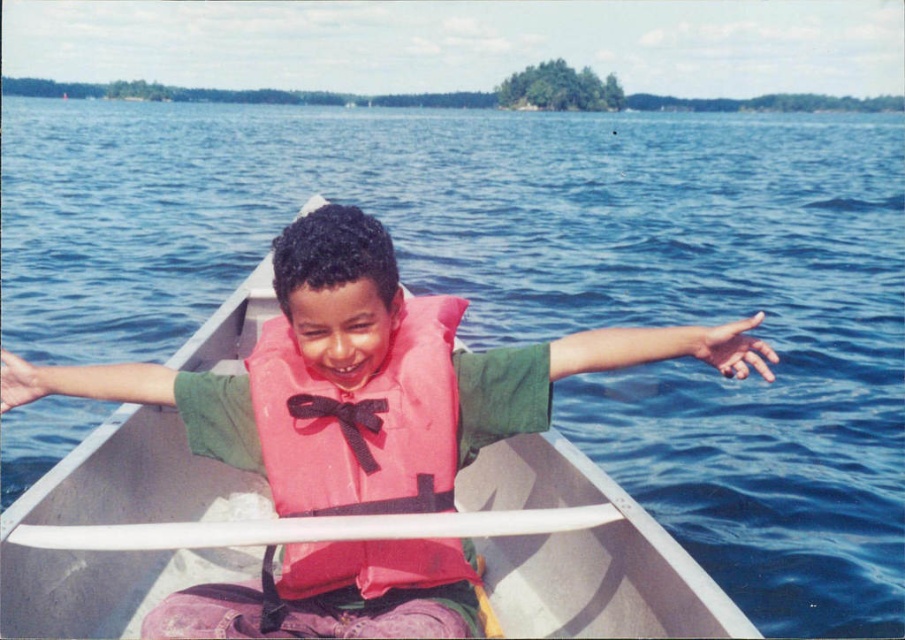
You are a photographer trying to capture the pink fabric life vest at center in a closeup shot. Given that the camera can only focus on objects within a 0.1 unit radius around the point of interest, will the point at coordinates point [329,390] be within the focus range?

The pink fabric life vest at center is represented by point [329,390], so yes, the point at coordinates point [329,390] will be within the focus range since it exactly matches the point of interest.

You are a photographer trying to capture the child in the canoe. You notice the pink fabric life jacket at center and the white plastic paddle at center. Which object is positioned to the right side of the other?

The pink fabric life jacket at center is to the right of the white plastic paddle at center.